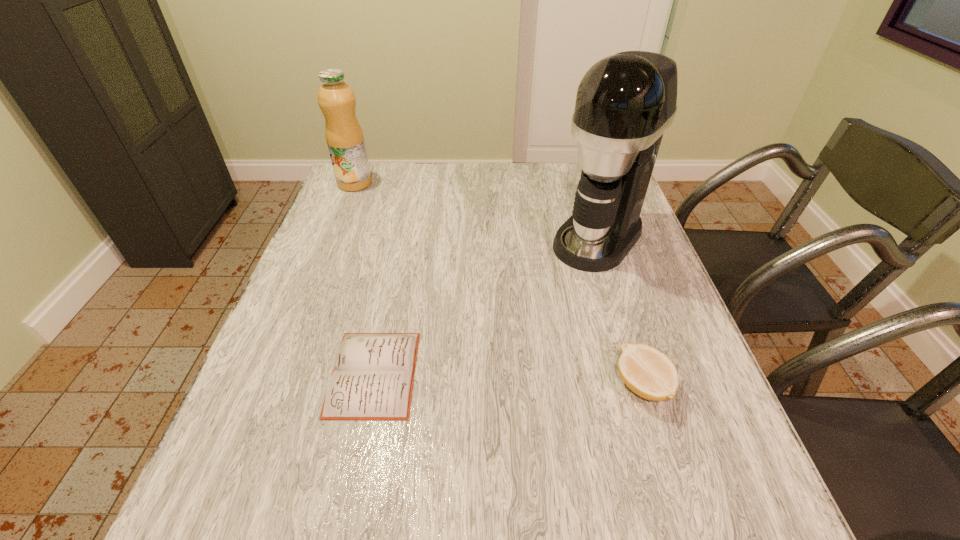
The width and height of the screenshot is (960, 540). Identify the location of free spot located place cup under the spout of the second farthest object. pos(507,345).

Image resolution: width=960 pixels, height=540 pixels. Find the location of `vacant space located 0.190m place cup under the spout of the second farthest object`. vacant space located 0.190m place cup under the spout of the second farthest object is located at coordinates (539, 309).

The image size is (960, 540). Identify the location of free location located on the front label of the fruit juice. (389, 224).

The height and width of the screenshot is (540, 960). Find the location of `free point located 0.120m on the front label of the fruit juice`. free point located 0.120m on the front label of the fruit juice is located at coordinates (376, 209).

At what (x,y) coordinates should I click in order to perform the action: click on vacant region located on the front label of the fruit juice. Please return your answer as a coordinate pair (x, y). This screenshot has height=540, width=960. Looking at the image, I should click on (414, 255).

This screenshot has height=540, width=960. I want to click on object that is at the far edge, so click(344, 136).

The width and height of the screenshot is (960, 540). What are the coordinates of `diary located in the near edge section of the desktop` in the screenshot? It's located at (373, 375).

Locate an element on the screen. lemon that is at the near edge is located at coordinates (649, 373).

I want to click on diary that is positioned at the left edge, so click(x=373, y=375).

The width and height of the screenshot is (960, 540). In order to click on fruit juice positioned at the left edge in this screenshot , I will do `click(344, 136)`.